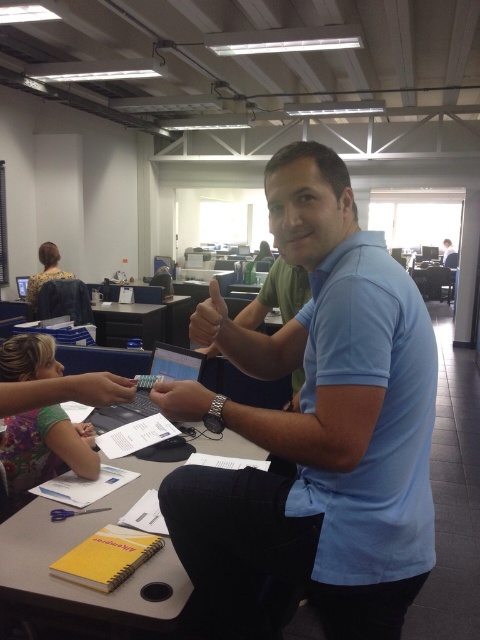
Question: Which point is farther to the camera?

Choices:
 (A) black plastic table at center
 (B) matte black hand at upper center

Answer: (A)

Question: Among these points, which one is farthest from the camera?

Choices:
 (A) (84, 433)
 (B) (91, 392)
 (C) (284, 538)
 (D) (69, 275)

Answer: (D)

Question: Is matte black pen at lower left further to the viewer compared to matte plastic pen at lower left?

Choices:
 (A) no
 (B) yes

Answer: (A)

Question: Is matte black pen at center to the left of matte black hand at upper center from the viewer's perspective?

Choices:
 (A) yes
 (B) no

Answer: (A)

Question: Which point is closer to the camera taking this photo?

Choices:
 (A) (38, 253)
 (B) (103, 310)
 (C) (322, 364)
 (D) (197, 320)

Answer: (C)

Question: Can you confirm if black plastic table at center is bigger than floral print blouse at upper left?

Choices:
 (A) yes
 (B) no

Answer: (B)